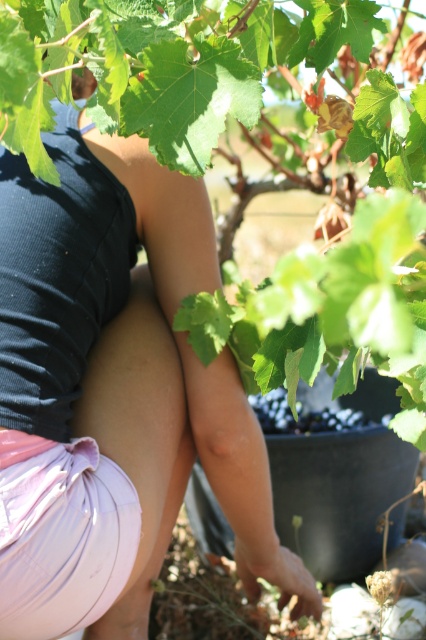
Question: Can you confirm if pink fabric at lower left is thinner than black matte grape at center?

Choices:
 (A) no
 (B) yes

Answer: (A)

Question: Which point is farther to the camera?

Choices:
 (A) (143, 348)
 (B) (325, 412)

Answer: (B)

Question: Which object appears closest to the camera in this image?

Choices:
 (A) pink fabric at lower left
 (B) black matte grape at center

Answer: (A)

Question: Does pink fabric at lower left have a greater width compared to black matte grape at center?

Choices:
 (A) no
 (B) yes

Answer: (B)

Question: Can you confirm if pink fabric at lower left is bigger than black matte grape at center?

Choices:
 (A) no
 (B) yes

Answer: (B)